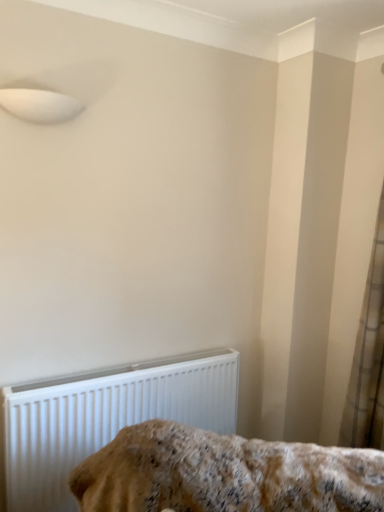
Find the location of a particular element. This screenshot has height=512, width=384. white plastic radiator at lower left is located at coordinates (106, 417).

This screenshot has height=512, width=384. Describe the element at coordinates (225, 474) in the screenshot. I see `fluffy beige blanket at lower center` at that location.

Locate an element on the screen. This screenshot has width=384, height=512. white plastic radiator at lower left is located at coordinates (106, 417).

From the image's perspective, is white plastic radiator at lower left below fluffy beige blanket at lower center?

Yes, from the image's perspective, white plastic radiator at lower left is below fluffy beige blanket at lower center.

Looking at the image, does white plastic radiator at lower left seem bigger or smaller compared to fluffy beige blanket at lower center?

Considering their sizes, white plastic radiator at lower left takes up less space than fluffy beige blanket at lower center.

Based on the photo, from a real-world perspective, is white plastic radiator at lower left physically above fluffy beige blanket at lower center?

No.

Do you think white plastic radiator at lower left is within fluffy beige blanket at lower center, or outside of it?

white plastic radiator at lower left cannot be found inside fluffy beige blanket at lower center.

The height and width of the screenshot is (512, 384). I want to click on curtain on the right of white plastic radiator at lower left, so click(368, 358).

Can we say white plastic radiator at lower left lies outside white sheer curtain at right?

Indeed, white plastic radiator at lower left is completely outside white sheer curtain at right.

Based on the photo, from the image's perspective, relative to white sheer curtain at right, is white plastic radiator at lower left above or below?

Based on their image positions, white plastic radiator at lower left is located beneath white sheer curtain at right.

Is white plastic radiator at lower left oriented towards white sheer curtain at right?

No, white plastic radiator at lower left does not turn towards white sheer curtain at right.

Is point (376, 249) closer or farther from the camera than point (179, 367)?

Point (376, 249) is positioned closer to the camera compared to point (179, 367).

From a real-world perspective, is white sheer curtain at right over white plastic radiator at lower left?

Yes, from a real-world perspective, white sheer curtain at right is on top of white plastic radiator at lower left.

I want to click on curtain behind the white plastic radiator at lower left, so click(368, 358).

Can you confirm if white sheer curtain at right is bigger than white plastic radiator at lower left?

Incorrect, white sheer curtain at right is not larger than white plastic radiator at lower left.

Which is more to the right, white sheer curtain at right or fluffy beige blanket at lower center?

white sheer curtain at right is more to the right.

Identify the location of curtain above the fluffy beige blanket at lower center (from a real-world perspective). (368, 358).

Is white sheer curtain at right wider than fluffy beige blanket at lower center?

No, white sheer curtain at right is not wider than fluffy beige blanket at lower center.

Is white sheer curtain at right facing away from fluffy beige blanket at lower center?

No.

Between point (291, 447) and point (94, 429), which one is positioned behind?

The point (94, 429) is more distant.

In the scene shown: Is white plastic radiator at lower left located within fluffy beige blanket at lower center?

Definitely not — white plastic radiator at lower left is not inside fluffy beige blanket at lower center.

Is fluffy beige blanket at lower center looking in the opposite direction of white plastic radiator at lower left?

Yes, fluffy beige blanket at lower center is positioned with its back facing white plastic radiator at lower left.

Are fluffy beige blanket at lower center and white plastic radiator at lower left far apart?

No, fluffy beige blanket at lower center is in close proximity to white plastic radiator at lower left.

Where is `furniture to the left of white sheer curtain at right`? The width and height of the screenshot is (384, 512). furniture to the left of white sheer curtain at right is located at coordinates (225, 474).

Between fluffy beige blanket at lower center and white sheer curtain at right, which one appears on the left side from the viewer's perspective?

fluffy beige blanket at lower center is more to the left.

Is fluffy beige blanket at lower center positioned with its back to white sheer curtain at right?

fluffy beige blanket at lower center is not turned away from white sheer curtain at right.

Would you say fluffy beige blanket at lower center is inside or outside white sheer curtain at right?

fluffy beige blanket at lower center is outside white sheer curtain at right.

Image resolution: width=384 pixels, height=512 pixels. In order to click on furniture that is above the white plastic radiator at lower left (from a real-world perspective) in this screenshot , I will do `click(225, 474)`.

Identify the location of curtain located behind the white plastic radiator at lower left. (368, 358).

Estimate the real-world distances between objects in this image. Which object is closer to white plastic radiator at lower left, white sheer curtain at right or fluffy beige blanket at lower center?

Based on the image, fluffy beige blanket at lower center appears to be nearer to white plastic radiator at lower left.

Looking at the image, which one is located closer to white sheer curtain at right, white plastic radiator at lower left or fluffy beige blanket at lower center?

Among the two, fluffy beige blanket at lower center is located nearer to white sheer curtain at right.

Estimate the real-world distances between objects in this image. Which object is further from fluffy beige blanket at lower center, white sheer curtain at right or white plastic radiator at lower left?

Based on the image, white sheer curtain at right appears to be further to fluffy beige blanket at lower center.

When comparing their distances from white sheer curtain at right, does fluffy beige blanket at lower center or white plastic radiator at lower left seem further?

Based on the image, white plastic radiator at lower left appears to be further to white sheer curtain at right.

Considering their positions, is fluffy beige blanket at lower center positioned closer to white plastic radiator at lower left than white sheer curtain at right?

The object closer to white plastic radiator at lower left is fluffy beige blanket at lower center.

Based on their spatial positions, is white plastic radiator at lower left or white sheer curtain at right closer to fluffy beige blanket at lower center?

Among the two, white plastic radiator at lower left is located nearer to fluffy beige blanket at lower center.

The height and width of the screenshot is (512, 384). What are the coordinates of `furniture between white plastic radiator at lower left and white sheer curtain at right` in the screenshot? It's located at (225, 474).